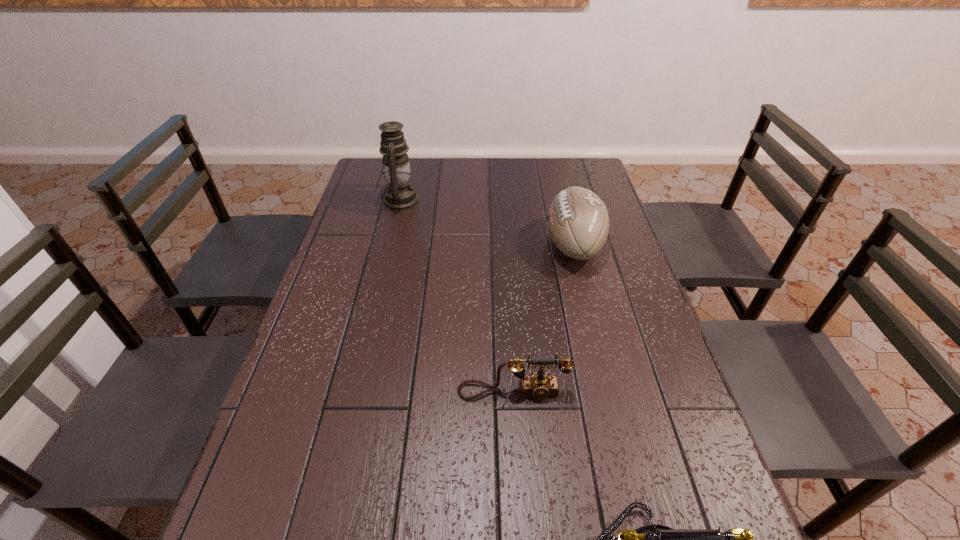
This screenshot has width=960, height=540. In order to click on the farthest object in this screenshot , I will do `click(400, 195)`.

Identify the location of the tallest object. The height and width of the screenshot is (540, 960). (400, 195).

Locate an element on the screen. Image resolution: width=960 pixels, height=540 pixels. the second farthest object is located at coordinates (578, 222).

The width and height of the screenshot is (960, 540). I want to click on the shorter telephone, so click(x=540, y=386).

Locate an element on the screen. This screenshot has height=540, width=960. the farther telephone is located at coordinates (540, 386).

Find the location of `blank space located on the front of the leftmost object`. blank space located on the front of the leftmost object is located at coordinates (394, 225).

Where is `blank area located 0.360m on the laces of the second farthest object`? The image size is (960, 540). blank area located 0.360m on the laces of the second farthest object is located at coordinates (428, 245).

Locate an element on the screen. This screenshot has width=960, height=540. vacant space located 0.080m on the laces of the second farthest object is located at coordinates (518, 245).

The image size is (960, 540). I want to click on free space located on the laces of the second farthest object, so click(480, 245).

This screenshot has width=960, height=540. I want to click on free region located 0.260m on the front-facing side of the shortest object, so click(x=522, y=534).